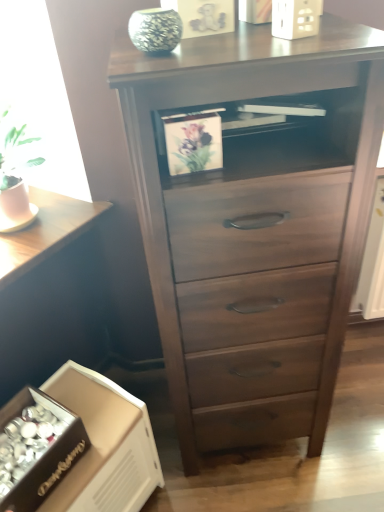
Image resolution: width=384 pixels, height=512 pixels. Identify the location of vacant area located to the right-hand side of green textured vase at upper center. (259, 31).